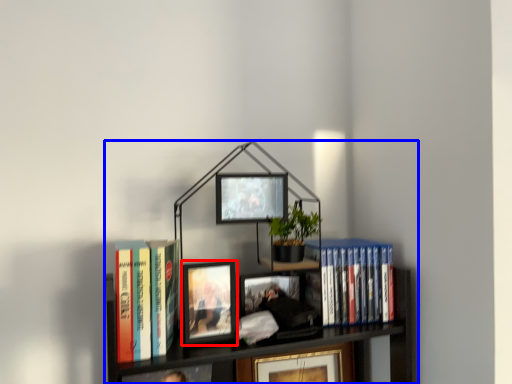
Question: Which point is closer to the camera, picture frame (highlighted by a red box) or bookcase (highlighted by a blue box)?

Choices:
 (A) picture frame
 (B) bookcase

Answer: (B)